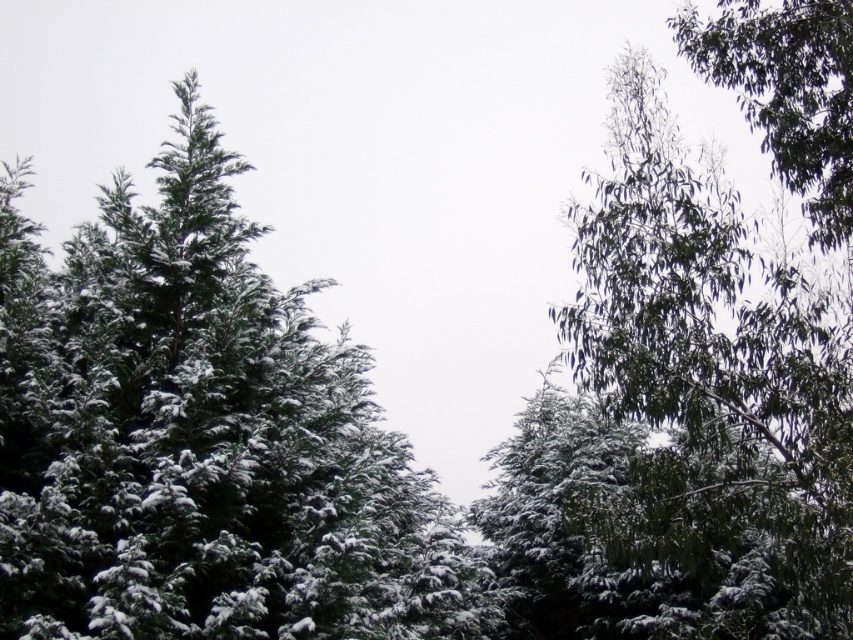
Is point (357, 481) positioned in front of point (809, 204)?

Yes, point (357, 481) is in front of point (809, 204).

Between point (270, 452) and point (844, 116), which one is positioned behind?

Point (844, 116)

Who is more distant from viewer, [102,230] or [752,10]?

Positioned behind is point [752,10].

Find the location of a particular element. The image size is (853, 640). snow-covered evergreen at center is located at coordinates (202, 436).